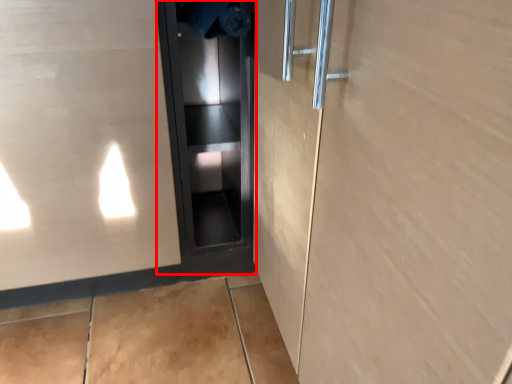
Question: From the image's perspective, where is elevator door (annotated by the red box) located relative to elevator door?

Choices:
 (A) below
 (B) above

Answer: (A)